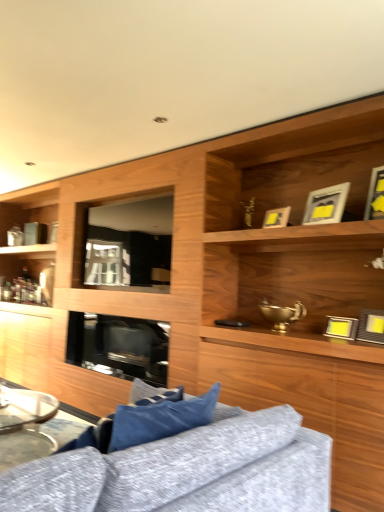
What is the approximate width of metallic silver picture frame at right, marked as the fifth picture frame in a top-to-bottom arrangement?

It is 5.26 inches.

Describe the element at coordinates (276, 217) in the screenshot. I see `matte gold picture frame at upper center, which ranks as the 3th picture frame in bottom-to-top order` at that location.

What do you see at coordinates (129, 242) in the screenshot? I see `transparent glass window at center` at bounding box center [129, 242].

What do you see at coordinates (326, 205) in the screenshot? The width and height of the screenshot is (384, 512). I see `matte gold picture frame at upper right, which is counted as the 2th picture frame, starting from the top` at bounding box center [326, 205].

The image size is (384, 512). Find the location of `metallic silver picture frame at right, marked as the fifth picture frame in a top-to-bottom arrangement`. metallic silver picture frame at right, marked as the fifth picture frame in a top-to-bottom arrangement is located at coordinates (341, 327).

Is point (339, 201) positioned before point (122, 203)?

Yes, point (339, 201) is in front of point (122, 203).

Is matte gold picture frame at upper right, which is counted as the fourth picture frame, starting from the bottom, wider or thinner than transparent glass window at center?

matte gold picture frame at upper right, which is counted as the fourth picture frame, starting from the bottom, is wider than transparent glass window at center.

Is matte gold picture frame at upper right, which is counted as the 2th picture frame, starting from the top, further to the viewer compared to transparent glass window at center?

No, it is in front of transparent glass window at center.

In the scene shown: Between matte gold picture frame at upper right, which is counted as the fourth picture frame, starting from the bottom, and transparent glass window at center, which one appears on the right side from the viewer's perspective?

matte gold picture frame at upper right, which is counted as the fourth picture frame, starting from the bottom.

The image size is (384, 512). Find the location of `studio couch on the left of matte yellow picture frame at upper right, the 1th picture frame positioned from the top`. studio couch on the left of matte yellow picture frame at upper right, the 1th picture frame positioned from the top is located at coordinates (190, 471).

Does point (377, 187) appear closer or farther from the camera than point (232, 500)?

Point (377, 187).

Could you tell me if matte yellow picture frame at upper right, the 1th picture frame positioned from the top, is facing textured gray fabric couch at lower center?

No.

Which is nearer, (162, 240) or (372, 196)?

The point (372, 196) is closer to the camera.

Is transparent glass window at center facing towards matte yellow picture frame at upper right, arranged as the 5th picture frame when ordered from the bottom?

No, transparent glass window at center is not aimed at matte yellow picture frame at upper right, arranged as the 5th picture frame when ordered from the bottom.

Looking at this image, is transparent glass window at center situated inside matte yellow picture frame at upper right, the 1th picture frame positioned from the top, or outside?

The correct answer is: outside.

The height and width of the screenshot is (512, 384). In the image, there is a matte yellow picture frame at upper right, the 1th picture frame positioned from the top. Identify the location of window below it (from a real-world perspective). (129, 242).

From the image's perspective, which one is positioned higher, matte gold picture frame at upper right, which is counted as the fourth picture frame, starting from the bottom, or black glass fireplace at center?

matte gold picture frame at upper right, which is counted as the fourth picture frame, starting from the bottom, appears higher in the image.

Does matte gold picture frame at upper right, which is counted as the 2th picture frame, starting from the top, have a lesser height compared to black glass fireplace at center?

Yes, matte gold picture frame at upper right, which is counted as the 2th picture frame, starting from the top, is shorter than black glass fireplace at center.

From the image's perspective, count 4th picture frames upward from the black glass fireplace at center and point to it. Please provide its 2D coordinates.

[(326, 205)]

Is matte gold picture frame at upper right, which is counted as the 2th picture frame, starting from the top, not within black glass fireplace at center?

Absolutely, matte gold picture frame at upper right, which is counted as the 2th picture frame, starting from the top, is external to black glass fireplace at center.

Is black glass fireplace at center not inside matte gold picture frame at upper center, acting as the 3th picture frame starting from the top?

Absolutely, black glass fireplace at center is external to matte gold picture frame at upper center, acting as the 3th picture frame starting from the top.

Can you confirm if black glass fireplace at center is thinner than matte gold picture frame at upper center, which ranks as the 3th picture frame in bottom-to-top order?

No, black glass fireplace at center is not thinner than matte gold picture frame at upper center, which ranks as the 3th picture frame in bottom-to-top order.

Which object is closer to the camera, black glass fireplace at center or matte gold picture frame at upper center, which ranks as the 3th picture frame in bottom-to-top order?

matte gold picture frame at upper center, which ranks as the 3th picture frame in bottom-to-top order.

Which point is more forward, (x=127, y=210) or (x=363, y=327)?

The point (x=363, y=327) is in front.

From the image's perspective, which is below, transparent glass window at center or yellow matte picture frame at right, which is counted as the fourth picture frame, starting from the top?

yellow matte picture frame at right, which is counted as the fourth picture frame, starting from the top, from the image's perspective.

Would you say transparent glass window at center is a long distance from yellow matte picture frame at right, the 2th picture frame from the bottom?

Yes, transparent glass window at center and yellow matte picture frame at right, the 2th picture frame from the bottom, are located far from each other.

Considering the sizes of objects transparent glass window at center and yellow matte picture frame at right, which is counted as the fourth picture frame, starting from the top, in the image provided, who is thinner, transparent glass window at center or yellow matte picture frame at right, which is counted as the fourth picture frame, starting from the top,?

transparent glass window at center.

From a real-world perspective, is transparent glass window at center below black glass fireplace at center?

Incorrect, from a real-world perspective, transparent glass window at center is higher than black glass fireplace at center.

From the image's perspective, is transparent glass window at center above black glass fireplace at center?

Yes.

Consider the image. Is transparent glass window at center situated inside black glass fireplace at center or outside?

transparent glass window at center is not enclosed by black glass fireplace at center.

Is point (119, 257) positioned before point (152, 342)?

Yes, point (119, 257) is closer to viewer.

At what (x,y) coordinates should I click in order to perform the action: click on window on the left of matte gold picture frame at upper right, which is counted as the fourth picture frame, starting from the bottom. Please return your answer as a coordinate pair (x, y). Looking at the image, I should click on (129, 242).

You are a GUI agent. You are given a task and a screenshot of the screen. Output one action in this format:
    pyautogui.click(x=<x>, y=<y>)
    Task: Click on the studio couch that appears below the matte yellow picture frame at upper right, the 1th picture frame positioned from the top (from the image's perspective)
    
    Given the screenshot: What is the action you would take?
    pyautogui.click(x=190, y=471)

Based on their spatial positions, is metallic silver tray at lower left or black glass fireplace at center further from textured gray fabric couch at lower center?

black glass fireplace at center is further to textured gray fabric couch at lower center.

Based on the photo, from the image, which object appears to be nearer to yellow matte picture frame at right, which is counted as the fourth picture frame, starting from the top, metallic silver tray at lower left or matte gold picture frame at upper center, acting as the 3th picture frame starting from the top?

Among the two, matte gold picture frame at upper center, acting as the 3th picture frame starting from the top, is located nearer to yellow matte picture frame at right, which is counted as the fourth picture frame, starting from the top.

Estimate the real-world distances between objects in this image. Which object is further from metallic silver picture frame at right, which is the first picture frame from bottom to top, yellow matte picture frame at right, which is counted as the fourth picture frame, starting from the top, or matte yellow picture frame at upper right, the 1th picture frame positioned from the top?

matte yellow picture frame at upper right, the 1th picture frame positioned from the top.

From the image, which object appears to be farther from metallic silver picture frame at right, marked as the fifth picture frame in a top-to-bottom arrangement, textured gray fabric couch at lower center or transparent glass window at center?

transparent glass window at center is further to metallic silver picture frame at right, marked as the fifth picture frame in a top-to-bottom arrangement.

Based on their spatial positions, is yellow matte picture frame at right, which is counted as the fourth picture frame, starting from the top, or matte yellow picture frame at upper right, the 1th picture frame positioned from the top, further from textured gray fabric couch at lower center?

matte yellow picture frame at upper right, the 1th picture frame positioned from the top, is positioned further to the anchor textured gray fabric couch at lower center.

Looking at the image, which one is located closer to matte gold picture frame at upper right, which is counted as the fourth picture frame, starting from the bottom, matte gold picture frame at upper center, which ranks as the 3th picture frame in bottom-to-top order, or black glass fireplace at center?

matte gold picture frame at upper center, which ranks as the 3th picture frame in bottom-to-top order, lies closer to matte gold picture frame at upper right, which is counted as the fourth picture frame, starting from the bottom, than the other object.

Estimate the real-world distances between objects in this image. Which object is closer to matte yellow picture frame at upper right, arranged as the 5th picture frame when ordered from the bottom, yellow matte picture frame at right, which is counted as the fourth picture frame, starting from the top, or metallic silver picture frame at right, which is the first picture frame from bottom to top?

yellow matte picture frame at right, which is counted as the fourth picture frame, starting from the top, lies closer to matte yellow picture frame at upper right, arranged as the 5th picture frame when ordered from the bottom, than the other object.

Estimate the real-world distances between objects in this image. Which object is further from black glass fireplace at center, yellow matte picture frame at right, the 2th picture frame from the bottom, or transparent glass window at center?

The object further to black glass fireplace at center is yellow matte picture frame at right, the 2th picture frame from the bottom.

The image size is (384, 512). I want to click on fireplace situated between transparent glass window at center and yellow matte picture frame at right, the 2th picture frame from the bottom, from left to right, so click(119, 346).

Where is `window between metallic silver tray at lower left and matte gold picture frame at upper right, which is counted as the fourth picture frame, starting from the bottom`? The image size is (384, 512). window between metallic silver tray at lower left and matte gold picture frame at upper right, which is counted as the fourth picture frame, starting from the bottom is located at coordinates (129, 242).

At what (x,y) coordinates should I click in order to perform the action: click on fireplace between transparent glass window at center and matte yellow picture frame at upper right, arranged as the 5th picture frame when ordered from the bottom. Please return your answer as a coordinate pair (x, y). The height and width of the screenshot is (512, 384). Looking at the image, I should click on [119, 346].

I want to click on fireplace between textured gray fabric couch at lower center and transparent glass window at center in the front-back direction, so click(119, 346).